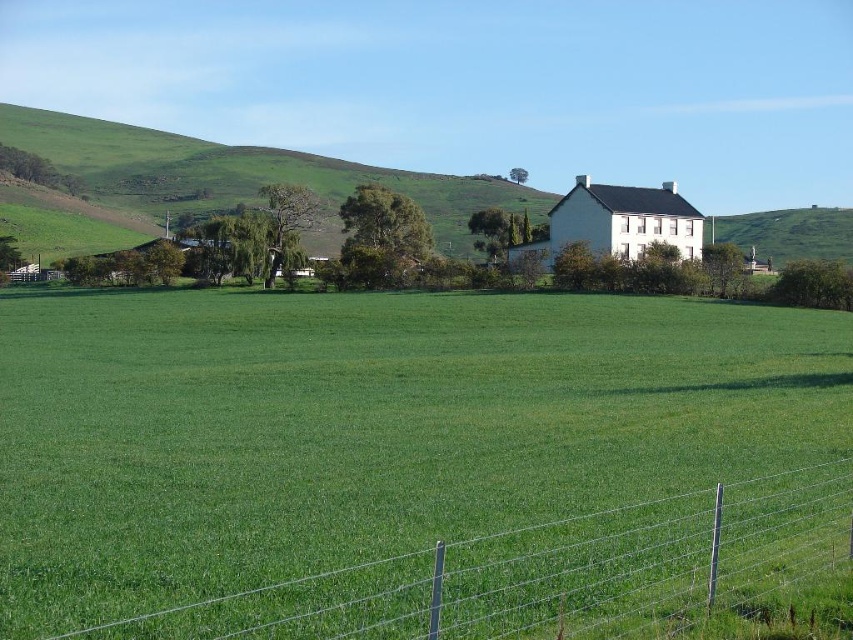
You are standing at the origin point in the image. Where is the green grass field at center located in terms of its 2D coordinates?

The green grass field at center is located at the 2D coordinates of point [364,424].

You are standing in the middle of the field and see the wire mesh fence at lower right and the green grassy hillside at upper left. Which object is located to the east of the other?

The wire mesh fence at lower right is positioned on the right side of green grassy hillside at upper left, so the wire mesh fence at lower right is east of the green grassy hillside at upper left.